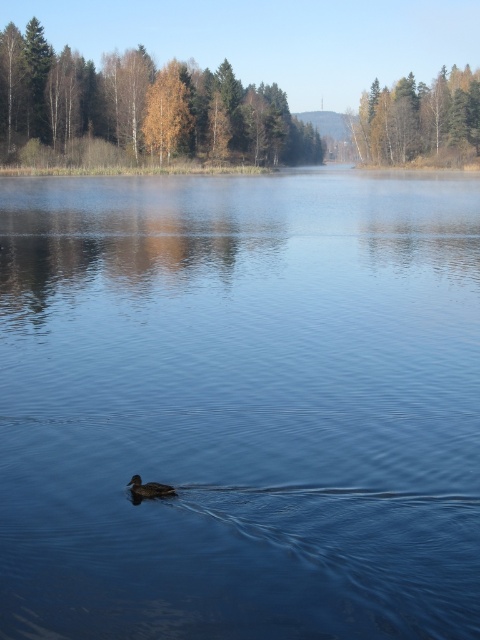
Question: Which object is farther from the camera taking this photo?

Choices:
 (A) transparent blue water at center
 (B) brown matte duck at center

Answer: (B)

Question: Which object appears closest to the camera in this image?

Choices:
 (A) brown matte duck at center
 (B) transparent blue water at center

Answer: (B)

Question: Can you confirm if transparent blue water at center is smaller than brown matte duck at center?

Choices:
 (A) no
 (B) yes

Answer: (A)

Question: In this image, where is transparent blue water at center located relative to brown matte duck at center?

Choices:
 (A) left
 (B) right

Answer: (B)

Question: Can you confirm if transparent blue water at center is wider than brown matte duck at center?

Choices:
 (A) no
 (B) yes

Answer: (B)